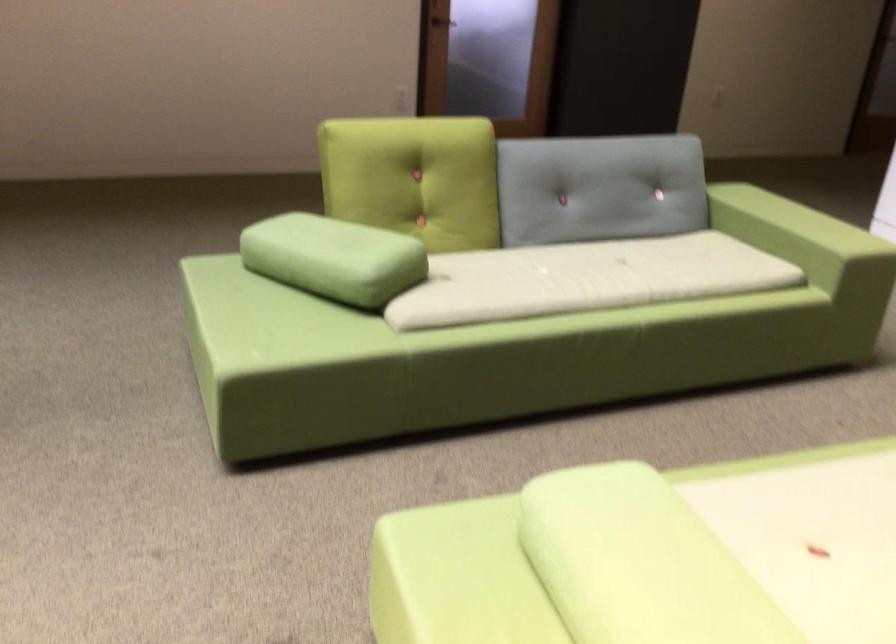
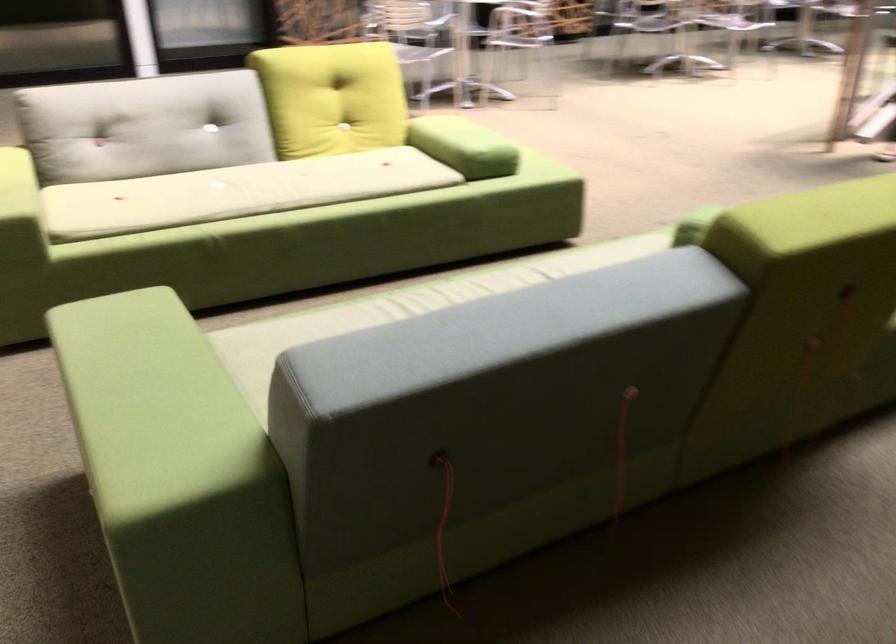
In the second image, find the point that corresponds to point 762,196 in the first image.

(151, 404)